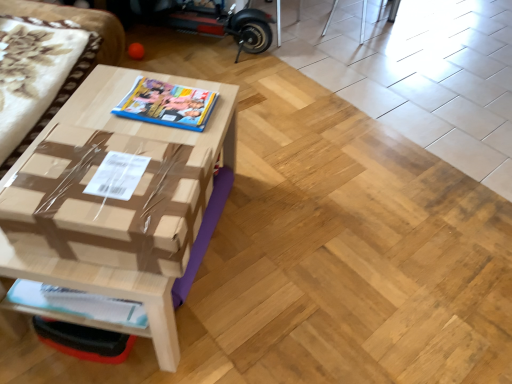
Identify the location of matte plastic magazine at center, arranged as the 1th magazine when viewed from the top. (167, 104).

At what (x,y) coordinates should I click in order to perform the action: click on white glossy magazine at lower left, marked as the 1th magazine in a front-to-back arrangement. Please return your answer as a coordinate pair (x, y). Looking at the image, I should click on (78, 303).

Where is `matte plastic magazine at center, placed as the 2th magazine when sorted from front to back`? The width and height of the screenshot is (512, 384). matte plastic magazine at center, placed as the 2th magazine when sorted from front to back is located at coordinates (167, 104).

Is matte plastic magazine at center, which is the second magazine from bottom to top, facing towards brown cardboard couch at left?

No, matte plastic magazine at center, which is the second magazine from bottom to top, does not turn towards brown cardboard couch at left.

From the image's perspective, is matte plastic magazine at center, arranged as the 1th magazine when viewed from the top, under brown cardboard couch at left?

Yes.

Is matte plastic magazine at center, arranged as the 1th magazine when viewed from the top, positioned behind brown cardboard couch at left?

Yes, matte plastic magazine at center, arranged as the 1th magazine when viewed from the top, is behind brown cardboard couch at left.

Which of these two, matte plastic magazine at center, which is the second magazine from bottom to top, or brown cardboard couch at left, is thinner?

matte plastic magazine at center, which is the second magazine from bottom to top.

Is there a large distance between matte plastic magazine at center, placed as the 2th magazine when sorted from front to back, and brown cardboard table at center?

matte plastic magazine at center, placed as the 2th magazine when sorted from front to back, is actually quite close to brown cardboard table at center.

Is matte plastic magazine at center, placed as the 2th magazine when sorted from front to back, to the right of brown cardboard table at center from the viewer's perspective?

Indeed, matte plastic magazine at center, placed as the 2th magazine when sorted from front to back, is positioned on the right side of brown cardboard table at center.

Is the depth of matte plastic magazine at center, arranged as the 1th magazine when viewed from the top, less than that of brown cardboard table at center?

No, it is behind brown cardboard table at center.

From a real-world perspective, which is physically above, brown cardboard couch at left or brown cardboard table at center?

brown cardboard couch at left.

Which is closer, (x=110, y=23) or (x=5, y=231)?

Point (x=110, y=23) is positioned farther from the camera compared to point (x=5, y=231).

Which of these two, brown cardboard couch at left or brown cardboard table at center, is wider?

brown cardboard couch at left.

Can you see brown cardboard couch at left touching brown cardboard table at center?

No, brown cardboard couch at left is not making contact with brown cardboard table at center.

In the image, is brown cardboard table at center positioned in front of or behind brown cardboard box at center?

Visually, brown cardboard table at center is located behind brown cardboard box at center.

Considering the sizes of objects brown cardboard table at center and brown cardboard box at center in the image provided, who is bigger, brown cardboard table at center or brown cardboard box at center?

With larger size is brown cardboard table at center.

Considering the sizes of objects brown cardboard table at center and brown cardboard box at center in the image provided, who is shorter, brown cardboard table at center or brown cardboard box at center?

With less height is brown cardboard box at center.

From a real-world perspective, between brown cardboard table at center and brown cardboard box at center, who is vertically lower?

brown cardboard table at center, from a real-world perspective.

Is white glossy magazine at lower left, marked as the 1th magazine in a front-to-back arrangement, surrounded by brown cardboard couch at left?

No.

From a real-world perspective, is brown cardboard couch at left on top of white glossy magazine at lower left, arranged as the second magazine when viewed from the back?

Yes, from a real-world perspective, brown cardboard couch at left is above white glossy magazine at lower left, arranged as the second magazine when viewed from the back.

Where is `couch in front of the white glossy magazine at lower left, acting as the second magazine starting from the top`? This screenshot has height=384, width=512. couch in front of the white glossy magazine at lower left, acting as the second magazine starting from the top is located at coordinates (79, 57).

From the image's perspective, is brown cardboard couch at left above white glossy magazine at lower left, acting as the second magazine starting from the top?

Indeed, from the image's perspective, brown cardboard couch at left is shown above white glossy magazine at lower left, acting as the second magazine starting from the top.

Is brown cardboard table at center facing towards brown cardboard couch at left?

No.

In the scene shown: How many degrees apart are the facing directions of brown cardboard table at center and brown cardboard couch at left?

brown cardboard table at center and brown cardboard couch at left are facing 6.86 degrees away from each other.

Consider the image. Can you confirm if brown cardboard table at center is bigger than brown cardboard couch at left?

No.

Is brown cardboard couch at left located within brown cardboard table at center?

That's incorrect, brown cardboard couch at left is not inside brown cardboard table at center.

Is white glossy magazine at lower left, acting as the second magazine starting from the top, turned away from brown cardboard couch at left?

That's not correct — white glossy magazine at lower left, acting as the second magazine starting from the top, is not looking away from brown cardboard couch at left.

Considering the sizes of objects white glossy magazine at lower left, acting as the second magazine starting from the top, and brown cardboard couch at left in the image provided, who is smaller, white glossy magazine at lower left, acting as the second magazine starting from the top, or brown cardboard couch at left?

With smaller size is white glossy magazine at lower left, acting as the second magazine starting from the top.

Which object is positioned more to the left, white glossy magazine at lower left, marked as the 1th magazine in a front-to-back arrangement, or brown cardboard couch at left?

brown cardboard couch at left is more to the left.

Considering the points (40, 306) and (118, 26), which point is behind, point (40, 306) or point (118, 26)?

The point (118, 26) is behind.

Locate an element on the screen. couch in front of the matte plastic magazine at center, arranged as the 1th magazine when viewed from the top is located at coordinates (79, 57).

The image size is (512, 384). I want to click on table below the matte plastic magazine at center, which is the second magazine from bottom to top (from a real-world perspective), so pos(116,201).

Which object lies further to the anchor point white glossy magazine at lower left, acting as the second magazine starting from the top, matte plastic magazine at center, placed as the 2th magazine when sorted from front to back, or brown cardboard couch at left?

Among the two, brown cardboard couch at left is located further to white glossy magazine at lower left, acting as the second magazine starting from the top.

Looking at the image, which one is located further to brown cardboard table at center, white glossy magazine at lower left, acting as the second magazine starting from the top, or matte plastic magazine at center, which is the second magazine from bottom to top?

white glossy magazine at lower left, acting as the second magazine starting from the top, lies further to brown cardboard table at center than the other object.

Based on their spatial positions, is brown cardboard box at center or white glossy magazine at lower left, marked as the 1th magazine in a front-to-back arrangement, further from matte plastic magazine at center, placed as the 2th magazine when sorted from front to back?

Among the two, white glossy magazine at lower left, marked as the 1th magazine in a front-to-back arrangement, is located further to matte plastic magazine at center, placed as the 2th magazine when sorted from front to back.

From the image, which object appears to be farther from brown cardboard couch at left, white glossy magazine at lower left, the first magazine ordered from the bottom, or brown cardboard box at center?

white glossy magazine at lower left, the first magazine ordered from the bottom, lies further to brown cardboard couch at left than the other object.

When comparing their distances from matte plastic magazine at center, which is counted as the first magazine, starting from the back, does brown cardboard table at center or brown cardboard couch at left seem closer?

brown cardboard table at center.

In the scene shown: Estimate the real-world distances between objects in this image. Which object is further from brown cardboard table at center, brown cardboard couch at left or brown cardboard box at center?

brown cardboard couch at left.

Looking at the image, which one is located closer to white glossy magazine at lower left, acting as the second magazine starting from the top, brown cardboard table at center or brown cardboard couch at left?

brown cardboard table at center.

Looking at the image, which one is located further to brown cardboard couch at left, brown cardboard table at center or matte plastic magazine at center, which is the second magazine from bottom to top?

The object further to brown cardboard couch at left is matte plastic magazine at center, which is the second magazine from bottom to top.

Where is `table between brown cardboard couch at left and matte plastic magazine at center, placed as the 2th magazine when sorted from front to back, from left to right`? Image resolution: width=512 pixels, height=384 pixels. table between brown cardboard couch at left and matte plastic magazine at center, placed as the 2th magazine when sorted from front to back, from left to right is located at coordinates (116, 201).

At what (x,y) coordinates should I click in order to perform the action: click on magazine between brown cardboard couch at left and white glossy magazine at lower left, acting as the second magazine starting from the top, from top to bottom. Please return your answer as a coordinate pair (x, y). The image size is (512, 384). Looking at the image, I should click on click(167, 104).

Identify the location of cardboard box between brown cardboard couch at left and white glossy magazine at lower left, acting as the second magazine starting from the top, from top to bottom. This screenshot has height=384, width=512. (106, 201).

Find the location of `cardboard box that lies between matte plastic magazine at center, which is the second magazine from bottom to top, and white glossy magazine at lower left, acting as the second magazine starting from the top, from top to bottom`. cardboard box that lies between matte plastic magazine at center, which is the second magazine from bottom to top, and white glossy magazine at lower left, acting as the second magazine starting from the top, from top to bottom is located at coordinates (106, 201).